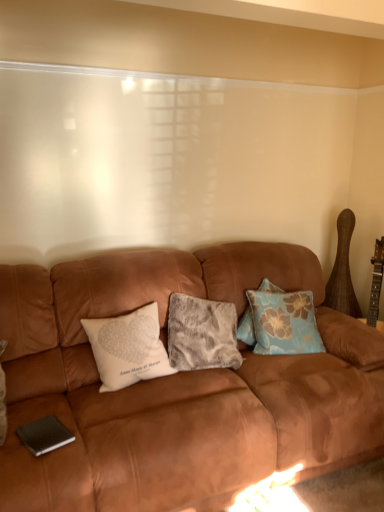
Question: Is white printed pillow at center, marked as the 1th pillow in a left-to-right arrangement, closer to camera compared to blue floral fabric pillow at center, which is counted as the 1th pillow, starting from the right?

Choices:
 (A) no
 (B) yes

Answer: (B)

Question: Are white printed pillow at center, marked as the 1th pillow in a left-to-right arrangement, and blue floral fabric pillow at center, which is counted as the third pillow, starting from the left, beside each other?

Choices:
 (A) no
 (B) yes

Answer: (A)

Question: Considering the relative positions of white printed pillow at center, marked as the 1th pillow in a left-to-right arrangement, and blue floral fabric pillow at center, which is counted as the 1th pillow, starting from the right, in the image provided, is white printed pillow at center, marked as the 1th pillow in a left-to-right arrangement, to the right of blue floral fabric pillow at center, which is counted as the 1th pillow, starting from the right, from the viewer's perspective?

Choices:
 (A) yes
 (B) no

Answer: (B)

Question: Is blue floral fabric pillow at center, which is counted as the 1th pillow, starting from the right, located within white printed pillow at center, marked as the 1th pillow in a left-to-right arrangement?

Choices:
 (A) yes
 (B) no

Answer: (B)

Question: Can you confirm if white printed pillow at center, the third pillow when ordered from right to left, is thinner than blue floral fabric pillow at center, which is counted as the 1th pillow, starting from the right?

Choices:
 (A) no
 (B) yes

Answer: (A)

Question: Is blue floral fabric pillow at center, which is counted as the third pillow, starting from the left, at the back of white printed pillow at center, marked as the 1th pillow in a left-to-right arrangement?

Choices:
 (A) no
 (B) yes

Answer: (A)

Question: Would you say blue floral fabric pillow at center, which is counted as the third pillow, starting from the left, is a long distance from white printed pillow at center, the third pillow when ordered from right to left?

Choices:
 (A) no
 (B) yes

Answer: (A)

Question: Is the position of blue floral fabric pillow at center, which is counted as the third pillow, starting from the left, more distant than that of white printed pillow at center, the third pillow when ordered from right to left?

Choices:
 (A) yes
 (B) no

Answer: (A)

Question: Can you confirm if blue floral fabric pillow at center, which is counted as the third pillow, starting from the left, is taller than white printed pillow at center, marked as the 1th pillow in a left-to-right arrangement?

Choices:
 (A) no
 (B) yes

Answer: (B)

Question: Would you say white printed pillow at center, marked as the 1th pillow in a left-to-right arrangement, is part of blue floral fabric pillow at center, which is counted as the third pillow, starting from the left,'s contents?

Choices:
 (A) yes
 (B) no

Answer: (B)

Question: Is blue floral fabric pillow at center, which is counted as the third pillow, starting from the left, bigger than white printed pillow at center, the third pillow when ordered from right to left?

Choices:
 (A) yes
 (B) no

Answer: (B)

Question: Can you confirm if blue floral fabric pillow at center, which is counted as the 1th pillow, starting from the right, is wider than white printed pillow at center, marked as the 1th pillow in a left-to-right arrangement?

Choices:
 (A) yes
 (B) no

Answer: (B)

Question: From a real-world perspective, is blue floral fabric pillow at center, which is counted as the 1th pillow, starting from the right, below fuzzy gray pillow at center, marked as the 2th pillow in a left-to-right arrangement?

Choices:
 (A) no
 (B) yes

Answer: (A)